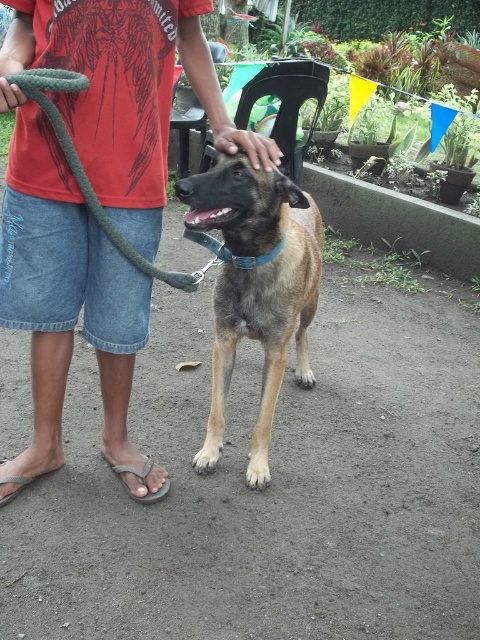
Question: In this image, where is denim shorts at lower left located relative to gray rubber sandal at lower left?

Choices:
 (A) above
 (B) below

Answer: (A)

Question: Is denim shorts at lower left closer to the viewer compared to green rope leash at left?

Choices:
 (A) no
 (B) yes

Answer: (A)

Question: Which point is farther from the camera taking this photo?

Choices:
 (A) (45, 81)
 (B) (262, 444)
 (C) (134, 470)
 (D) (51, 467)

Answer: (B)

Question: Which is nearer to the gray rubber sandal at lower left?

Choices:
 (A) green rope leash at left
 (B) gray fabric sandal at lower left

Answer: (B)

Question: Does denim shorts at lower left appear on the left side of gray rubber sandal at lower left?

Choices:
 (A) yes
 (B) no

Answer: (B)

Question: Among these objects, which one is farthest from the camera?

Choices:
 (A) denim shorts at lower left
 (B) gray rubber sandal at lower left
 (C) brown fur dog at center

Answer: (B)